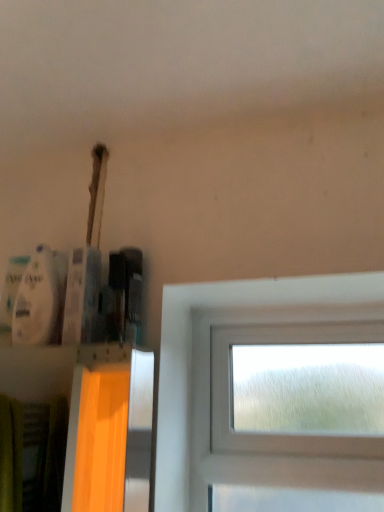
The image size is (384, 512). What are the coordinates of `orange glossy screen door at lower left` in the screenshot? It's located at (109, 431).

What is the approximate width of orange glossy screen door at lower left?

It is 2.58 centimeters.

Describe the element at coordinates (109, 431) in the screenshot. I see `orange glossy screen door at lower left` at that location.

Locate an element on the screen. orange glossy screen door at lower left is located at coordinates click(109, 431).